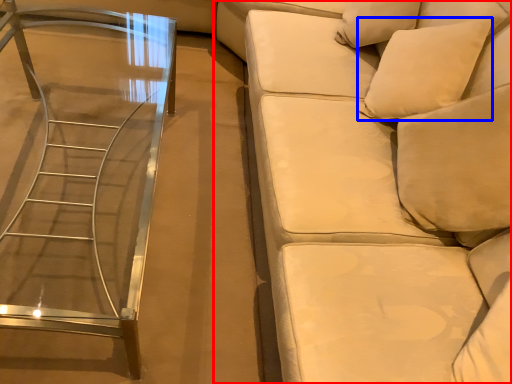
Question: Which object is closer to the camera taking this photo, studio couch (highlighted by a red box) or pillow (highlighted by a blue box)?

Choices:
 (A) studio couch
 (B) pillow

Answer: (A)